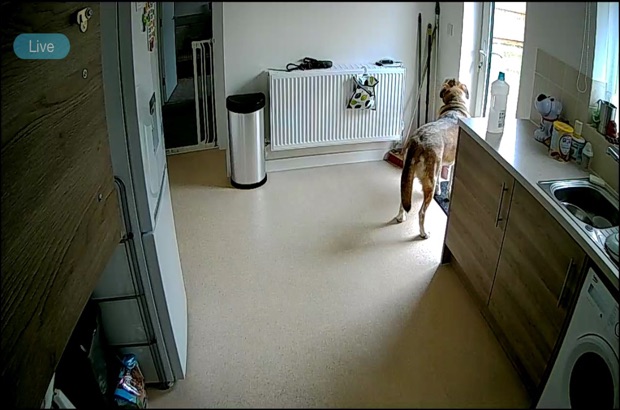
You are a GUI agent. You are given a task and a screenshot of the screen. Output one action in this format:
    pyautogui.click(x=<x>, y=<y>)
    Task: Click on the gray walls
    
    Given the screenshot: What is the action you would take?
    pyautogui.click(x=294, y=37), pyautogui.click(x=142, y=65), pyautogui.click(x=560, y=32)